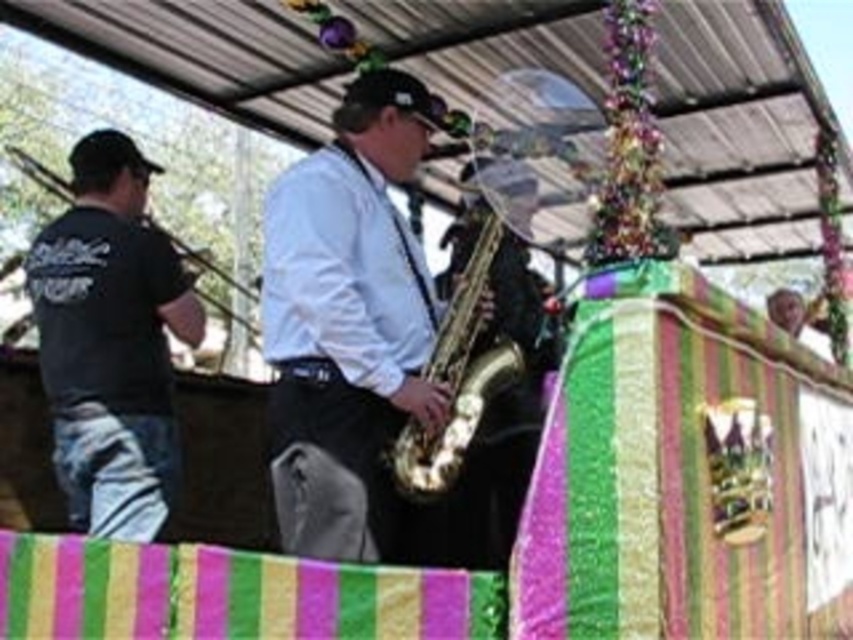
You are standing at the center of the scene and want to find the black matte shirt at left. According to the coordinates provided, in which direction should you look to locate it?

The black matte shirt at left is located at coordinates point (109, 342), which means it is to the left side of the scene. Therefore, you should look to the left to locate it.

You are a photographer at this event and want to capture a photo where both the shiny gold saxophone at center and the black matte shirt at left are visible. Given their heights, which object should you focus on to ensure both are in frame without needing to adjust your camera angle?

The shiny gold saxophone at center is taller than the black matte shirt at left. To ensure both are in frame, focus on the shiny gold saxophone at center as it is the taller object and will occupy more of the vertical space, allowing the shorter black matte shirt at left to be captured naturally within the same frame.

You are a photographer standing at the back of the venue. You want to take a photo that includes both the shiny gold saxophone at center and the black matte shirt at left. The minimum distance your camera can focus clearly is 1 meter. Will both subjects be in focus if they are exactly 1.06 meters apart?

The shiny gold saxophone at center is 1.06 meters from the black matte shirt at left. Since the minimum focus distance is 1 meter, the 1.06 meter separation means both subjects will be within the camera focus range and thus in focus.